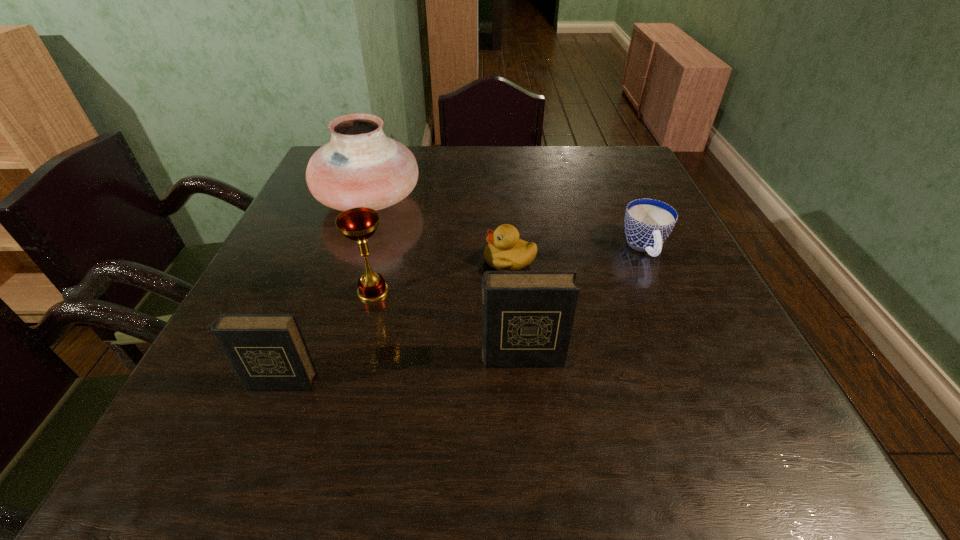
Locate an element on the screen. free space located on the front-facing side of the duckling is located at coordinates (447, 260).

Where is `vacant region located on the front-facing side of the duckling`? The width and height of the screenshot is (960, 540). vacant region located on the front-facing side of the duckling is located at coordinates (447, 260).

Find the location of a particular element. The height and width of the screenshot is (540, 960). free spot located 0.050m on the front-facing side of the duckling is located at coordinates (461, 260).

In order to click on vacant space located on the right of the pottery in this screenshot , I will do `click(519, 200)`.

Where is `free space located 0.160m on the side of the rightmost object with the handle`? Image resolution: width=960 pixels, height=540 pixels. free space located 0.160m on the side of the rightmost object with the handle is located at coordinates (678, 323).

You are a GUI agent. You are given a task and a screenshot of the screen. Output one action in this format:
    pyautogui.click(x=<x>, y=<y>)
    Task: Click on the object that is positioned at the far edge
    The height and width of the screenshot is (540, 960).
    Given the screenshot: What is the action you would take?
    point(360,167)

At what (x,y) coordinates should I click in order to perform the action: click on diary present at the left edge. Please return your answer as a coordinate pair (x, y). Looking at the image, I should click on (268, 351).

I want to click on pottery that is at the left edge, so click(x=360, y=167).

You are a GUI agent. You are given a task and a screenshot of the screen. Output one action in this format:
    pyautogui.click(x=<x>, y=<y>)
    Task: Click on the object that is at the right edge
    
    Given the screenshot: What is the action you would take?
    pyautogui.click(x=648, y=222)

Identify the location of object at the far left corner. (360, 167).